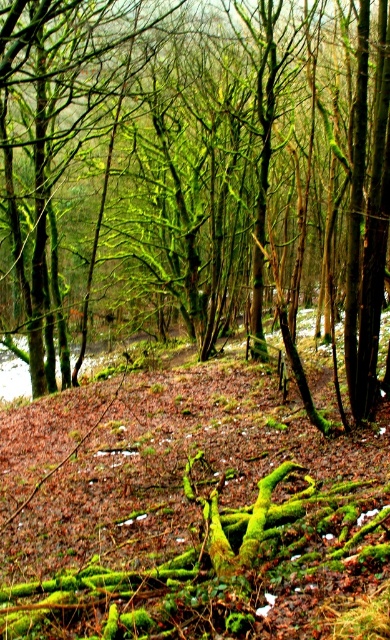
You are navigating through the forest and want to move from the starting point at point (92, 257) to the destination at point (202, 435). Since the forest has uneven ground and dense trees, will you have to go around any obstacles between these two points?

Point (92, 257) is behind point (202, 435), so you will have to go around obstacles between them as you move from the starting point to the destination.

You are navigating through the forest and need to find a specific tree marked at point (203, 173). Which tree should you look for?

The green mossy tree at center is located at point (203, 173).

You are a hiker navigating through the forest and need to cross a small stream that flows between the green mossy tree at center and the green mossy roots at lower center. Which direction should you head to avoid getting your boots wet?

The green mossy tree at center is above the green mossy roots at lower center, so you should head towards the green mossy tree at center to avoid the stream at lower center.